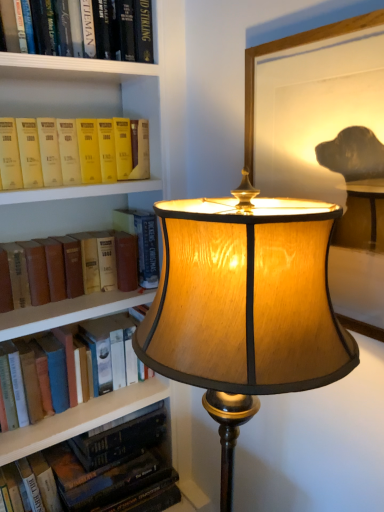
Question: Is hardcover book at lower left, which is the fifth book from top to bottom, not within hardcover book at left, placed as the 4th book when sorted from top to bottom?

Choices:
 (A) yes
 (B) no

Answer: (A)

Question: Is hardcover book at lower left, which is the fifth book from top to bottom, positioned behind hardcover book at left, placed as the 4th book when sorted from top to bottom?

Choices:
 (A) yes
 (B) no

Answer: (A)

Question: From the image's perspective, is hardcover book at lower left, positioned as the 1th book in bottom-to-top order, beneath hardcover book at left, the 2th book when ordered from bottom to top?

Choices:
 (A) yes
 (B) no

Answer: (A)

Question: Does hardcover book at lower left, positioned as the 1th book in bottom-to-top order, have a lesser height compared to hardcover book at left, placed as the 4th book when sorted from top to bottom?

Choices:
 (A) no
 (B) yes

Answer: (A)

Question: Considering the relative sizes of hardcover book at lower left, which is the fifth book from top to bottom, and hardcover book at left, the 2th book when ordered from bottom to top, in the image provided, is hardcover book at lower left, which is the fifth book from top to bottom, wider than hardcover book at left, the 2th book when ordered from bottom to top,?

Choices:
 (A) yes
 (B) no

Answer: (A)

Question: Is the depth of wooden picture frame at upper right less than that of brown leather book at left, which is counted as the 3th book, starting from the top?

Choices:
 (A) no
 (B) yes

Answer: (B)

Question: Is wooden picture frame at upper right placed right next to brown leather book at left, which is counted as the 3th book, starting from the top?

Choices:
 (A) no
 (B) yes

Answer: (A)

Question: From the image's perspective, does wooden picture frame at upper right appear lower than brown leather book at left, which is counted as the 3th book, starting from the bottom?

Choices:
 (A) yes
 (B) no

Answer: (B)

Question: Is wooden picture frame at upper right shorter than brown leather book at left, which is counted as the 3th book, starting from the top?

Choices:
 (A) yes
 (B) no

Answer: (B)

Question: Could you tell me if wooden picture frame at upper right is facing brown leather book at left, which is counted as the 3th book, starting from the top?

Choices:
 (A) yes
 (B) no

Answer: (B)

Question: Can you confirm if wooden picture frame at upper right is smaller than brown leather book at left, which is counted as the 3th book, starting from the bottom?

Choices:
 (A) yes
 (B) no

Answer: (B)

Question: Considering the relative positions of matte yellow book at left, the 5th book from the bottom, and hardcover book at lower left, positioned as the 1th book in bottom-to-top order, in the image provided, is matte yellow book at left, the 5th book from the bottom, to the left of hardcover book at lower left, positioned as the 1th book in bottom-to-top order, from the viewer's perspective?

Choices:
 (A) yes
 (B) no

Answer: (A)